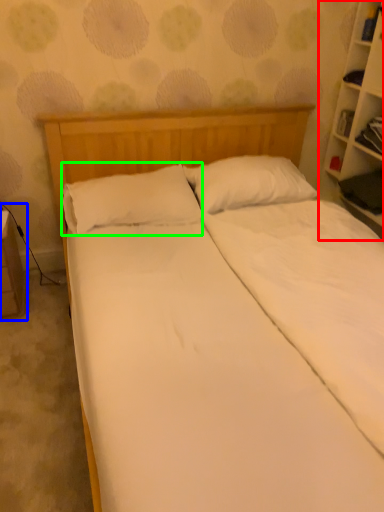
Question: Which object is the farthest from bookcase (highlighted by a red box)? Choose among these: table (highlighted by a blue box) or pillow (highlighted by a green box).

Choices:
 (A) table
 (B) pillow

Answer: (A)